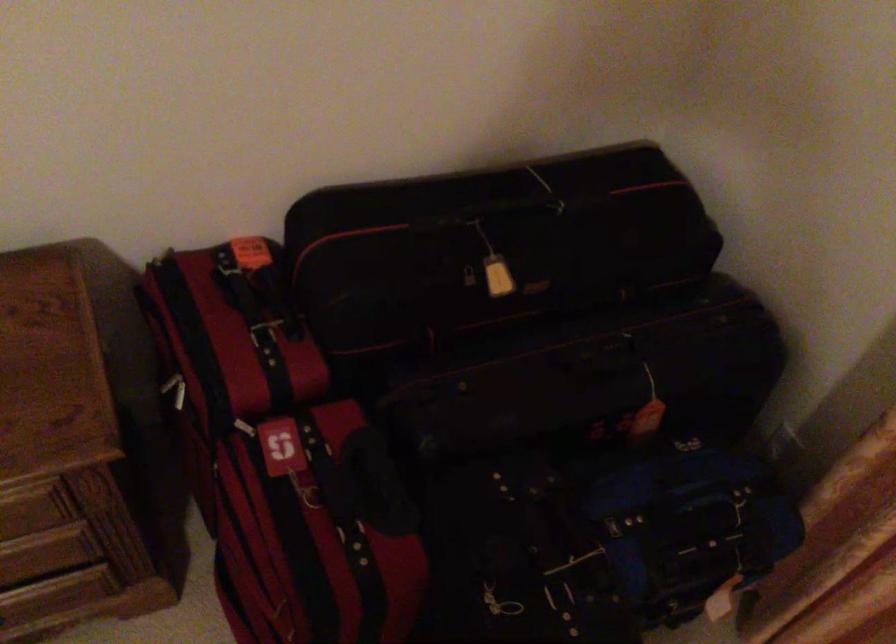
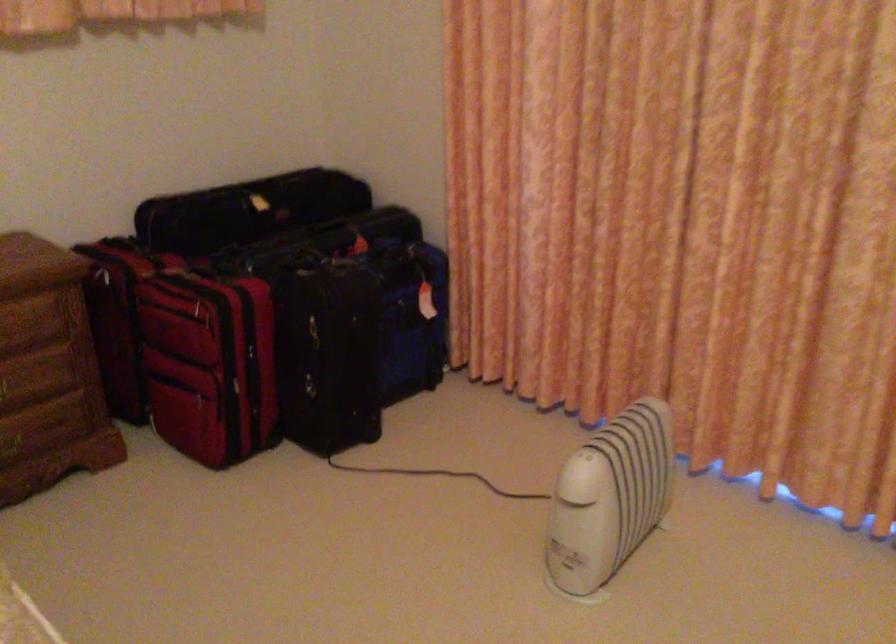
In the second image, find the point that corresponds to [374,570] in the first image.

(243, 292)